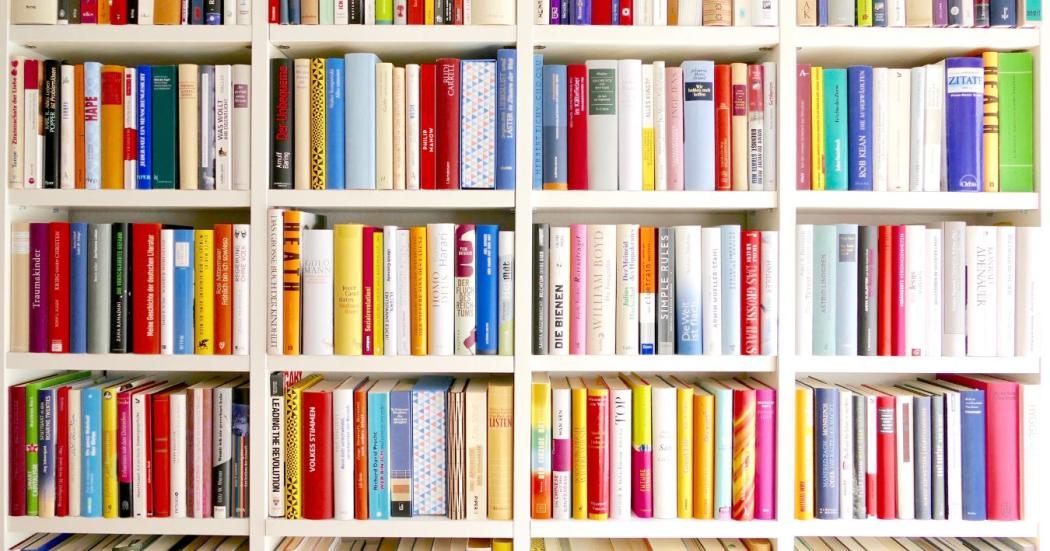
The width and height of the screenshot is (1050, 551). I want to click on 3rd shelve, so click(130, 361), click(385, 364), click(689, 361), click(900, 368).